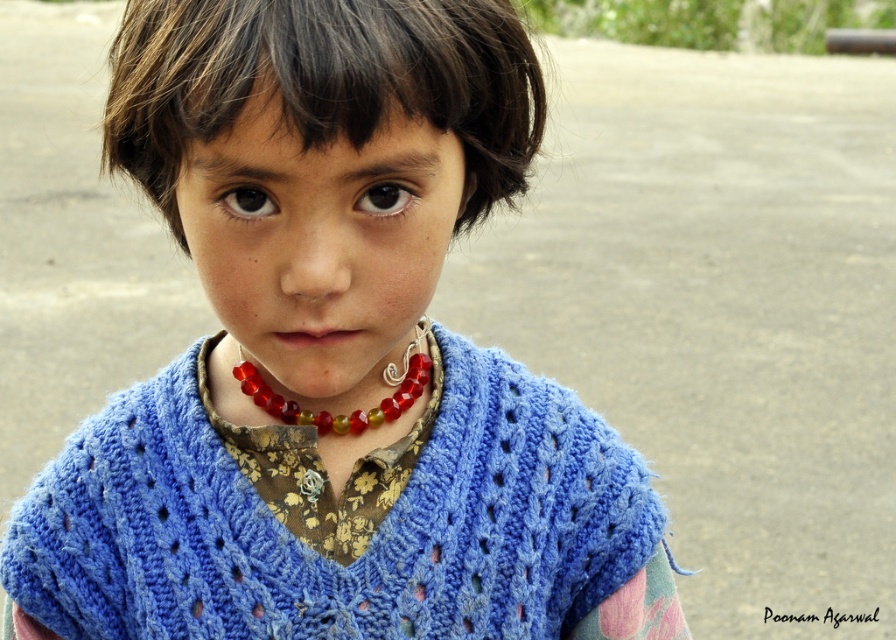
Between blue knitted shawl at center and translucent red beads at center, which one appears on the right side from the viewer's perspective?

translucent red beads at center

Does blue knitted shawl at center appear on the left side of translucent red beads at center?

Yes, blue knitted shawl at center is to the left of translucent red beads at center.

What do you see at coordinates (342, 518) in the screenshot? I see `blue knitted shawl at center` at bounding box center [342, 518].

You are a GUI agent. You are given a task and a screenshot of the screen. Output one action in this format:
    pyautogui.click(x=<x>, y=<y>)
    Task: Click on the blue knitted shawl at center
    
    Given the screenshot: What is the action you would take?
    pyautogui.click(x=342, y=518)